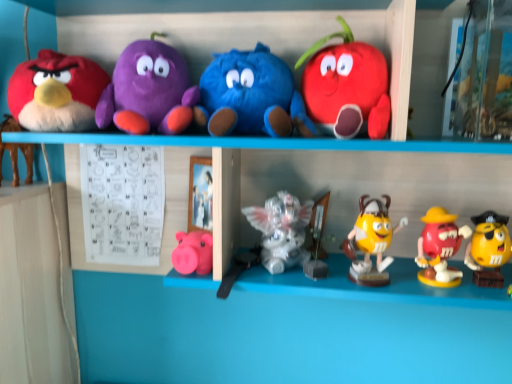
Question: Is yellow glossy m&m figure at center, acting as the third toy starting from the right, positioned with its back to matte plush bird at left, the 9th toy in the right-to-left sequence?

Choices:
 (A) yes
 (B) no

Answer: (B)

Question: Is matte plush bird at left, the 9th toy in the right-to-left sequence, inside yellow glossy m&m figure at center, arranged as the 8th toy when viewed from the left?

Choices:
 (A) yes
 (B) no

Answer: (B)

Question: Can you see yellow glossy m&m figure at center, acting as the third toy starting from the right, touching matte plush bird at left, the 9th toy in the right-to-left sequence?

Choices:
 (A) no
 (B) yes

Answer: (A)

Question: Can you confirm if yellow glossy m&m figure at center, arranged as the 8th toy when viewed from the left, is bigger than matte plush bird at left, the second toy from the left?

Choices:
 (A) no
 (B) yes

Answer: (A)

Question: Is yellow glossy m&m figure at center, arranged as the 8th toy when viewed from the left, closer to camera compared to matte plush bird at left, the second toy from the left?

Choices:
 (A) yes
 (B) no

Answer: (B)

Question: From the image's perspective, is yellow glossy m&m figure at center, arranged as the 8th toy when viewed from the left, under matte plush bird at left, the 9th toy in the right-to-left sequence?

Choices:
 (A) yes
 (B) no

Answer: (A)

Question: From the image's perspective, is brown plush toy at left, which ranks as the 10th toy in right-to-left order, over matte plush toy at upper right, marked as the 7th toy in a left-to-right arrangement?

Choices:
 (A) yes
 (B) no

Answer: (B)

Question: Is brown plush toy at left, which ranks as the 10th toy in right-to-left order, facing away from matte plush toy at upper right, the 4th toy in the right-to-left sequence?

Choices:
 (A) no
 (B) yes

Answer: (A)

Question: Is brown plush toy at left, which ranks as the 10th toy in right-to-left order, smaller than matte plush toy at upper right, the 4th toy in the right-to-left sequence?

Choices:
 (A) no
 (B) yes

Answer: (B)

Question: Is brown plush toy at left, the 1th toy from the left, not near matte plush toy at upper right, the 4th toy in the right-to-left sequence?

Choices:
 (A) yes
 (B) no

Answer: (B)

Question: Can you confirm if brown plush toy at left, the 1th toy from the left, is shorter than matte plush toy at upper right, the 4th toy in the right-to-left sequence?

Choices:
 (A) no
 (B) yes

Answer: (B)

Question: Can you confirm if brown plush toy at left, the 1th toy from the left, is thinner than matte plush toy at upper right, marked as the 7th toy in a left-to-right arrangement?

Choices:
 (A) no
 (B) yes

Answer: (A)

Question: Considering the relative positions of matte pink piggy bank at lower center, which is the 7th toy in right-to-left order, and brown plush toy at left, which ranks as the 10th toy in right-to-left order, in the image provided, is matte pink piggy bank at lower center, which is the 7th toy in right-to-left order, behind brown plush toy at left, which ranks as the 10th toy in right-to-left order,?

Choices:
 (A) no
 (B) yes

Answer: (A)